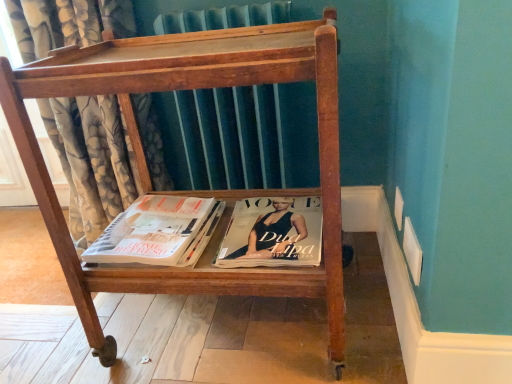
Locate an element on the screen. This screenshot has height=384, width=512. blank space situated above matte white book at center (from a real-world perspective) is located at coordinates (142, 225).